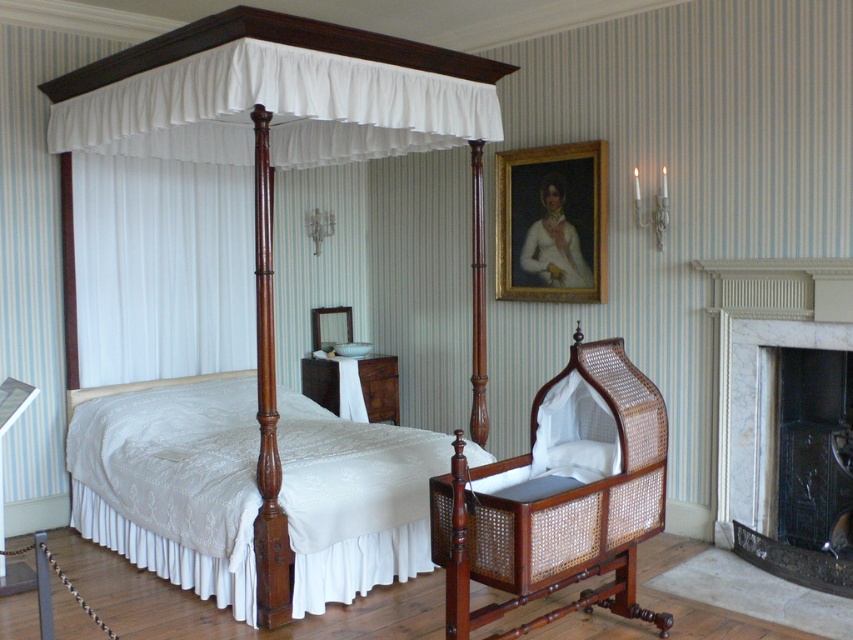
Question: Is white marble fireplace at right to the right of goldwooden frame at upper center from the viewer's perspective?

Choices:
 (A) no
 (B) yes

Answer: (B)

Question: Can you confirm if woven cane cradle at lower center is positioned to the right of goldwooden frame at upper center?

Choices:
 (A) no
 (B) yes

Answer: (A)

Question: Among these objects, which one is nearest to the camera?

Choices:
 (A) matte wood bed frame at center
 (B) white marble fireplace at right
 (C) white fabric canopy at upper left
 (D) goldwooden frame at upper center

Answer: (A)

Question: Does woven cane cradle at lower center appear on the right side of mahogany wood canopy bed at center?

Choices:
 (A) yes
 (B) no

Answer: (A)

Question: Which point is closer to the camera?

Choices:
 (A) goldwooden frame at upper center
 (B) woven cane cradle at lower center
 (C) matte wood bed frame at center
 (D) white fabric canopy at upper left

Answer: (B)

Question: Which object appears farthest from the camera in this image?

Choices:
 (A) white marble fireplace at right
 (B) mahogany wood canopy bed at center
 (C) white fabric canopy at upper left

Answer: (C)